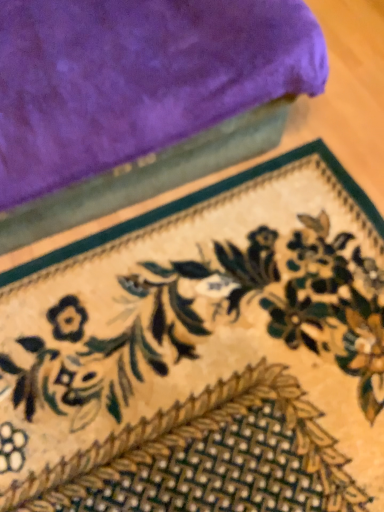
What is the approximate height of velvet purple towel at upper left?

It is 70.12 centimeters.

Image resolution: width=384 pixels, height=512 pixels. I want to click on velvet purple towel at upper left, so click(x=137, y=79).

The width and height of the screenshot is (384, 512). What do you see at coordinates (137, 79) in the screenshot?
I see `velvet purple towel at upper left` at bounding box center [137, 79].

The height and width of the screenshot is (512, 384). What do you see at coordinates (203, 354) in the screenshot?
I see `floral-patterned carpet at lower center` at bounding box center [203, 354].

What is the approximate width of floral-patterned carpet at lower center?

36.46 inches.

You are a GUI agent. You are given a task and a screenshot of the screen. Output one action in this format:
    pyautogui.click(x=<x>, y=<y>)
    Task: Click on the floral-patterned carpet at lower center
    
    Given the screenshot: What is the action you would take?
    pyautogui.click(x=203, y=354)

From the picture: Measure the distance between point (177, 263) and camera.

Point (177, 263) and camera are 1.18 meters apart from each other.

The image size is (384, 512). I want to click on velvet purple towel at upper left, so click(x=137, y=79).

Is velvet purple towel at upper left at the right side of floral-patterned carpet at lower center?

No, velvet purple towel at upper left is not to the right of floral-patterned carpet at lower center.

Considering the relative positions of velvet purple towel at upper left and floral-patterned carpet at lower center in the image provided, is velvet purple towel at upper left in front of floral-patterned carpet at lower center?

That is True.

Which is in front, point (26, 162) or point (115, 401)?

Positioned in front is point (26, 162).

From the image's perspective, which one is positioned lower, velvet purple towel at upper left or floral-patterned carpet at lower center?

floral-patterned carpet at lower center, from the image's perspective.

Based on the photo, from a real-world perspective, is velvet purple towel at upper left positioned above or below floral-patterned carpet at lower center?

In terms of real-world spatial position, velvet purple towel at upper left is above floral-patterned carpet at lower center.

Which of these two, velvet purple towel at upper left or floral-patterned carpet at lower center, is wider?

Wider between the two is floral-patterned carpet at lower center.

From the picture: Considering the relative sizes of velvet purple towel at upper left and floral-patterned carpet at lower center in the image provided, is velvet purple towel at upper left taller than floral-patterned carpet at lower center?

Correct, velvet purple towel at upper left is much taller as floral-patterned carpet at lower center.

Who is smaller, velvet purple towel at upper left or floral-patterned carpet at lower center?

With smaller size is floral-patterned carpet at lower center.

Is velvet purple towel at upper left completely or partially outside of floral-patterned carpet at lower center?

velvet purple towel at upper left lies outside floral-patterned carpet at lower center's area.

Is velvet purple towel at upper left positioned far away from floral-patterned carpet at lower center?

No, there isn't a large distance between velvet purple towel at upper left and floral-patterned carpet at lower center.

In the scene shown: Is velvet purple towel at upper left turned away from floral-patterned carpet at lower center?

No, velvet purple towel at upper left's orientation is not away from floral-patterned carpet at lower center.

What are the coordinates of `mat behind the velvet purple towel at upper left` in the screenshot? It's located at (x=203, y=354).

Considering the positions of objects floral-patterned carpet at lower center and velvet purple towel at upper left in the image provided, who is more to the right, floral-patterned carpet at lower center or velvet purple towel at upper left?

floral-patterned carpet at lower center.

Which object is more forward, floral-patterned carpet at lower center or velvet purple towel at upper left?

velvet purple towel at upper left is closer to the camera.

Between point (371, 409) and point (102, 123), which one is positioned in front?

The point (102, 123) is in front.

From the image's perspective, does floral-patterned carpet at lower center appear lower than velvet purple towel at upper left?

Yes.

From a real-world perspective, is floral-patterned carpet at lower center positioned under velvet purple towel at upper left based on gravity?

Yes, from a real-world perspective, floral-patterned carpet at lower center is beneath velvet purple towel at upper left.

Which of these two, floral-patterned carpet at lower center or velvet purple towel at upper left, is wider?

floral-patterned carpet at lower center is wider.

Does floral-patterned carpet at lower center have a lesser height compared to velvet purple towel at upper left?

Indeed, floral-patterned carpet at lower center has a lesser height compared to velvet purple towel at upper left.

In the scene shown: Is floral-patterned carpet at lower center smaller than velvet purple towel at upper left?

Yes.

Can we say floral-patterned carpet at lower center lies outside velvet purple towel at upper left?

That's correct, floral-patterned carpet at lower center is outside of velvet purple towel at upper left.

Are floral-patterned carpet at lower center and velvet purple towel at upper left located far from each other?

No, floral-patterned carpet at lower center is not far away from velvet purple towel at upper left.

Is floral-patterned carpet at lower center positioned with its back to velvet purple towel at upper left?

That's not correct — floral-patterned carpet at lower center is not looking away from velvet purple towel at upper left.

Measure the distance from floral-patterned carpet at lower center to velvet purple towel at upper left.

floral-patterned carpet at lower center and velvet purple towel at upper left are 18.59 inches apart.

Image resolution: width=384 pixels, height=512 pixels. I want to click on mat behind the velvet purple towel at upper left, so click(x=203, y=354).

This screenshot has height=512, width=384. I want to click on mat below the velvet purple towel at upper left (from the image's perspective), so [203, 354].

Where is `towel above the floral-patterned carpet at lower center (from the image's perspective)`? This screenshot has width=384, height=512. towel above the floral-patterned carpet at lower center (from the image's perspective) is located at coordinates (137, 79).